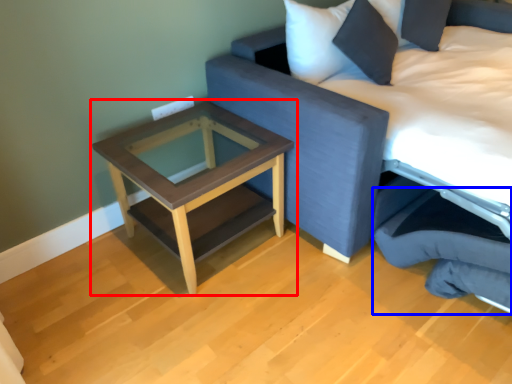
Question: Which of the following is the closest to the observer, table (highlighted by a red box) or swivel chair (highlighted by a blue box)?

Choices:
 (A) table
 (B) swivel chair

Answer: (B)